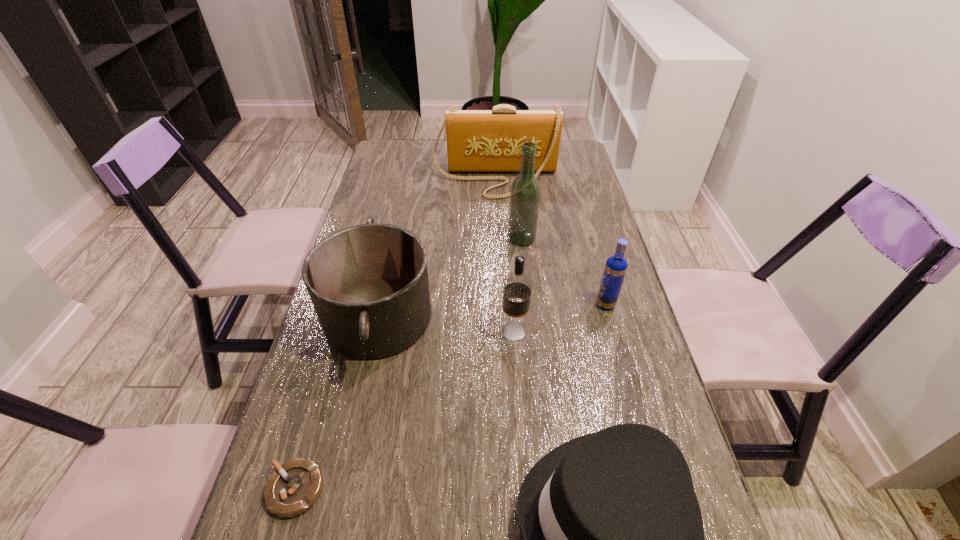
Where is `object at the far right corner`? The height and width of the screenshot is (540, 960). object at the far right corner is located at coordinates (477, 140).

This screenshot has height=540, width=960. Identify the location of free space at the far edge of the desktop. (443, 162).

Locate an element on the screen. This screenshot has height=540, width=960. vacant space at the left edge of the desktop is located at coordinates (362, 207).

You are a GUI agent. You are given a task and a screenshot of the screen. Output one action in this format:
    pyautogui.click(x=<x>, y=<y>)
    Task: Click on the vacant space at the right edge
    The image size is (960, 540).
    Given the screenshot: What is the action you would take?
    pyautogui.click(x=589, y=182)

The width and height of the screenshot is (960, 540). In order to click on vacant area that lies between the tallest object and the farthest object in this screenshot , I will do `click(508, 209)`.

At what (x,y) coordinates should I click in order to perform the action: click on vacant space that is in between the right vodka and the left vodka. Please return your answer as a coordinate pair (x, y). This screenshot has width=960, height=540. Looking at the image, I should click on (560, 317).

Find the location of `free space between the left vodka and the right vodka`. free space between the left vodka and the right vodka is located at coordinates (560, 317).

Image resolution: width=960 pixels, height=540 pixels. I want to click on vacant area that lies between the pan and the right vodka, so click(x=492, y=311).

The image size is (960, 540). Identify the location of empty space that is in between the left vodka and the handbag. (504, 255).

At what (x,y) coordinates should I click in order to perform the action: click on free space between the farthest object and the right vodka. Please return your answer as a coordinate pair (x, y). Image resolution: width=960 pixels, height=540 pixels. Looking at the image, I should click on (550, 241).